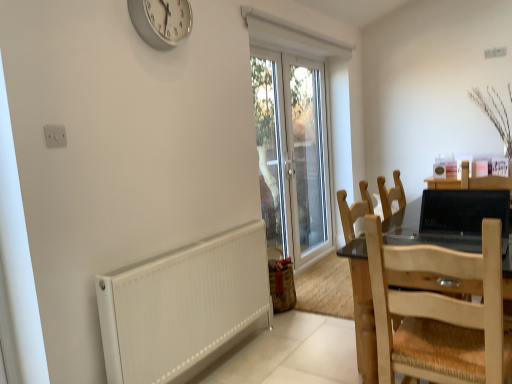
Question: Could you tell me if natural wood chair at right, which is counted as the 1th chair, starting from the front, is turned towards black glossy laptop at right?

Choices:
 (A) no
 (B) yes

Answer: (B)

Question: Considering the relative sizes of natural wood chair at right, arranged as the second chair when viewed from the back, and black glossy laptop at right in the image provided, is natural wood chair at right, arranged as the second chair when viewed from the back, shorter than black glossy laptop at right?

Choices:
 (A) yes
 (B) no

Answer: (B)

Question: From the image's perspective, is natural wood chair at right, arranged as the second chair when viewed from the back, under black glossy laptop at right?

Choices:
 (A) yes
 (B) no

Answer: (A)

Question: Is natural wood chair at right, which is counted as the 1th chair, starting from the front, smaller than black glossy laptop at right?

Choices:
 (A) no
 (B) yes

Answer: (A)

Question: From a real-world perspective, is natural wood chair at right, arranged as the second chair when viewed from the back, located higher than black glossy laptop at right?

Choices:
 (A) yes
 (B) no

Answer: (B)

Question: Considering the positions of black glossy laptop at right and transparent glass door at center in the image, is black glossy laptop at right bigger or smaller than transparent glass door at center?

Choices:
 (A) small
 (B) big

Answer: (A)

Question: Is black glossy laptop at right taller or shorter than transparent glass door at center?

Choices:
 (A) short
 (B) tall

Answer: (A)

Question: Is black glossy laptop at right wider or thinner than transparent glass door at center?

Choices:
 (A) wide
 (B) thin

Answer: (A)

Question: Is black glossy laptop at right spatially inside transparent glass door at center, or outside of it?

Choices:
 (A) outside
 (B) inside

Answer: (A)

Question: From the image's perspective, is natural wood chair at right, arranged as the second chair when viewed from the back, above or below light brown wooden chair at right, which is counted as the 2th chair, starting from the front?

Choices:
 (A) below
 (B) above

Answer: (A)

Question: Is natural wood chair at right, which is counted as the 1th chair, starting from the front, spatially inside light brown wooden chair at right, which is counted as the first chair, starting from the back, or outside of it?

Choices:
 (A) inside
 (B) outside

Answer: (B)

Question: In terms of height, does natural wood chair at right, which is counted as the 1th chair, starting from the front, look taller or shorter compared to light brown wooden chair at right, which is counted as the 2th chair, starting from the front?

Choices:
 (A) short
 (B) tall

Answer: (A)

Question: Does point tap(493, 314) appear closer or farther from the camera than point tap(366, 362)?

Choices:
 (A) closer
 (B) farther

Answer: (A)

Question: Is transparent glass door at center spatially inside silver metallic clock at upper center, or outside of it?

Choices:
 (A) outside
 (B) inside

Answer: (A)

Question: From a real-world perspective, relative to silver metallic clock at upper center, is transparent glass door at center vertically above or below?

Choices:
 (A) above
 (B) below

Answer: (B)